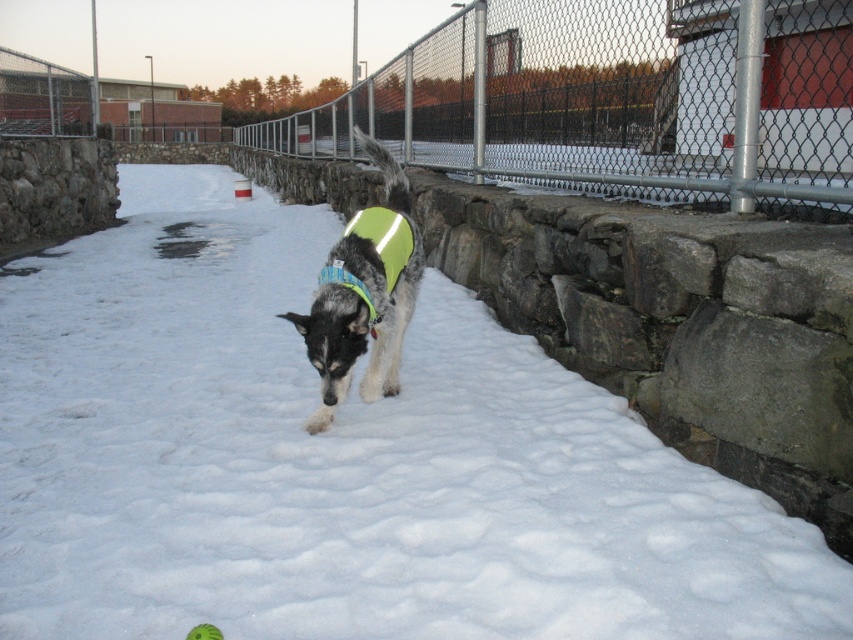
Who is positioned more to the left, metal chain-link fence at upper center or neon green fabric vest at center?

Positioned to the left is neon green fabric vest at center.

Does point (763, 144) come farther from viewer compared to point (408, 252)?

Yes.

Locate an element on the screen. metal chain-link fence at upper center is located at coordinates (612, 99).

Measure the distance between white fluffy snow at center and camera.

A distance of 6.84 feet exists between white fluffy snow at center and camera.

In the scene shown: Is white fluffy snow at center shorter than neon green fabric vest at center?

No, white fluffy snow at center is not shorter than neon green fabric vest at center.

Between point (480, 506) and point (392, 246), which one is positioned behind?

The point (392, 246) is more distant.

The width and height of the screenshot is (853, 640). What are the coordinates of `white fluffy snow at center` in the screenshot? It's located at coord(341,461).

Between white fluffy snow at center and metal chain-link fence at upper center, which one is positioned higher?

metal chain-link fence at upper center is above.

Between point (537, 456) and point (404, 109), which one is positioned in front?

Point (537, 456)

Is point (115, 388) positioned behind point (677, 128)?

No, it is not.

Locate an element on the screen. This screenshot has width=853, height=640. white fluffy snow at center is located at coordinates (341, 461).